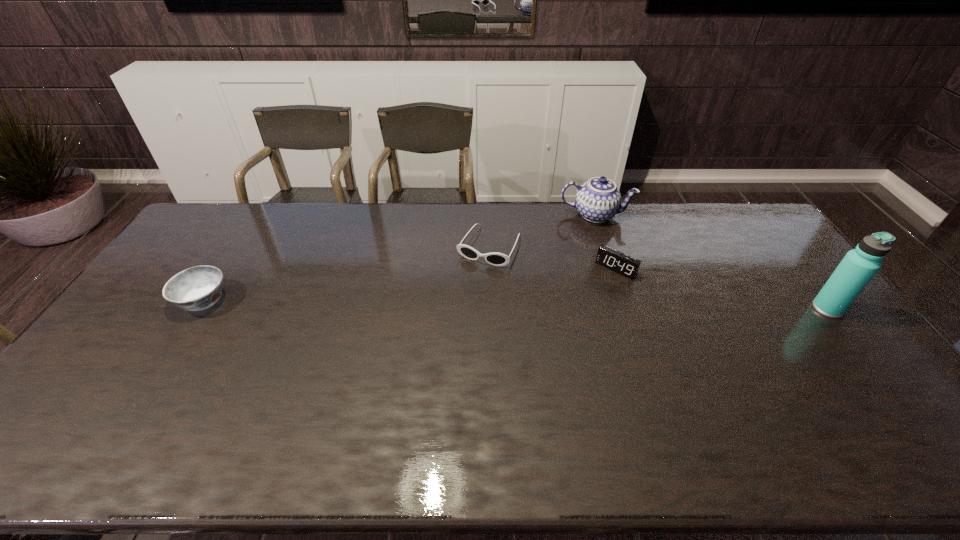
This screenshot has height=540, width=960. Find the location of `free space on the desktop that is between the ashtray and the rightmost object and is positioned on the front-facing side of the alarm clock`. free space on the desktop that is between the ashtray and the rightmost object and is positioned on the front-facing side of the alarm clock is located at coordinates (583, 305).

The image size is (960, 540). Identify the location of vacant space on the desktop that is between the leftmost object and the rightmost object and is positioned with the lenses of the shortest object facing outward. (457, 303).

You are a GUI agent. You are given a task and a screenshot of the screen. Output one action in this format:
    pyautogui.click(x=<x>, y=<y>)
    Task: Click on the vacant space on the desktop that is between the ashtray and the thermos bottle and is positioned at the spout of the chinaware
    This screenshot has height=540, width=960.
    Given the screenshot: What is the action you would take?
    pyautogui.click(x=589, y=305)